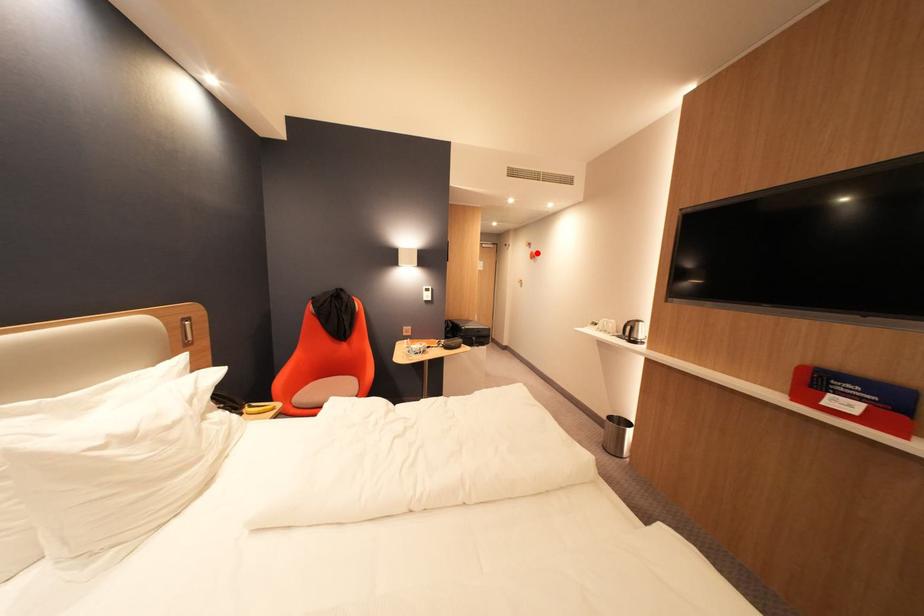
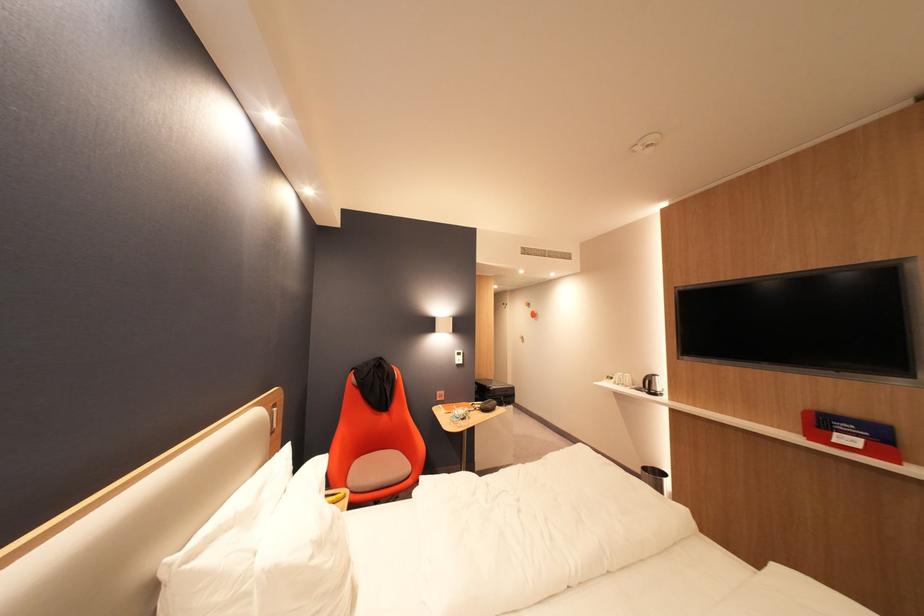
Where in the second image is the point corresponding to the highlighted location from the first image?

(538, 313)